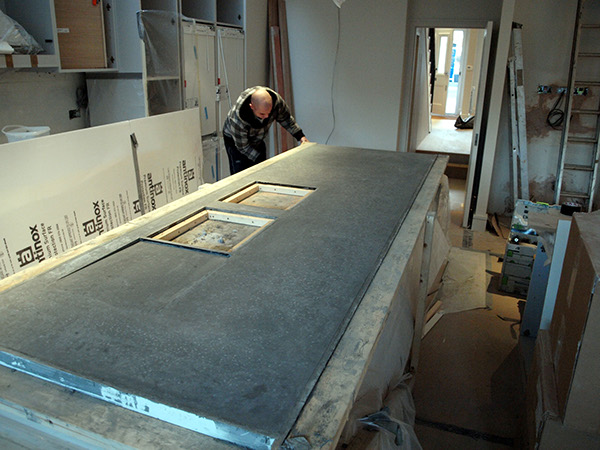
Where is `cord`? This screenshot has width=600, height=450. cord is located at coordinates coord(339,42).